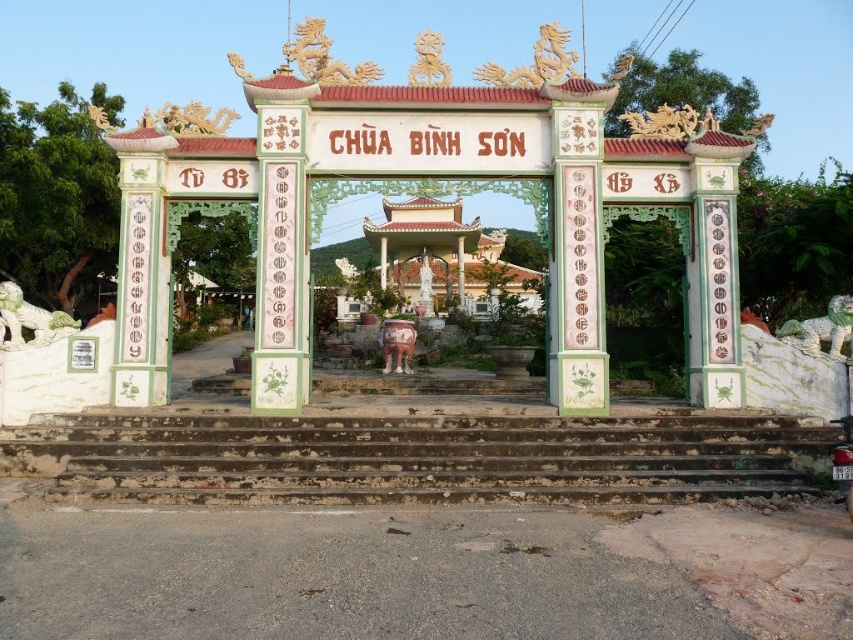
Question: Can you confirm if green stone lion at left is positioned above white marble lion at right?

Choices:
 (A) no
 (B) yes

Answer: (B)

Question: Which point is farther to the camera?

Choices:
 (A) (808, 340)
 (B) (1, 312)

Answer: (A)

Question: Among these points, which one is nearest to the camera?

Choices:
 (A) (779, 332)
 (B) (537, 426)
 (C) (627, 300)

Answer: (B)

Question: Does dirty concrete stairs at center have a greater width compared to white marble lion at right?

Choices:
 (A) no
 (B) yes

Answer: (B)

Question: Can you confirm if dirty concrete stairs at center is smaller than white marble lion at right?

Choices:
 (A) no
 (B) yes

Answer: (A)

Question: Which object is farther from the camera taking this photo?

Choices:
 (A) green stone lion at left
 (B) dirty concrete stairs at center

Answer: (A)